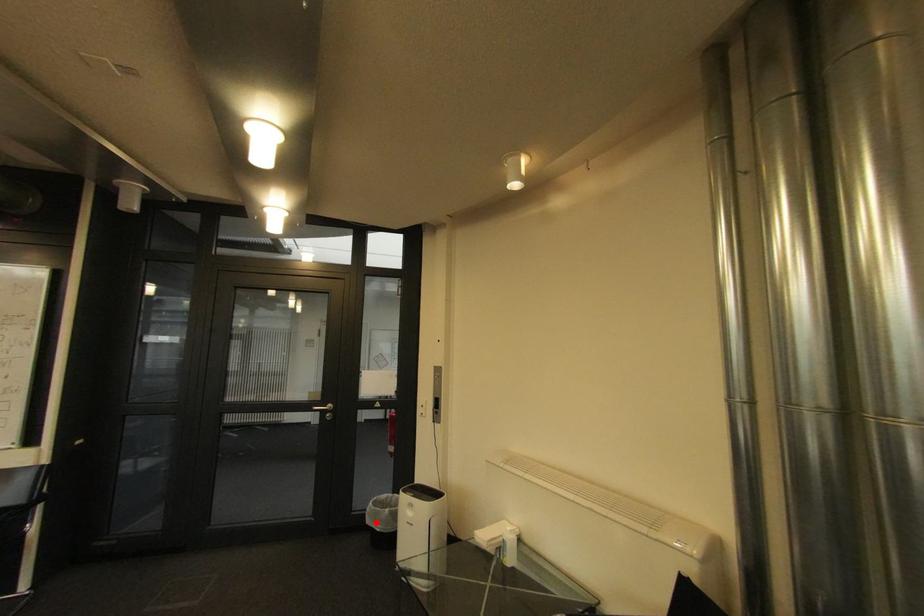
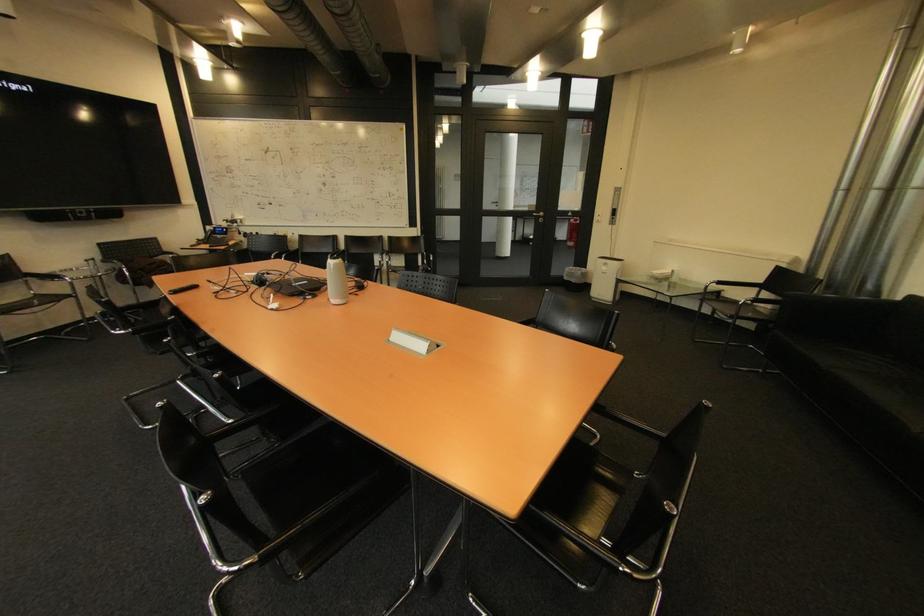
Question: I am providing you with two images of the same scene from different viewpoints. Given a red point in image1, look at the same physical point in image2. Is it:

Choices:
 (A) Closer to the viewpoint
 (B) Farther from the viewpoint

Answer: (A)